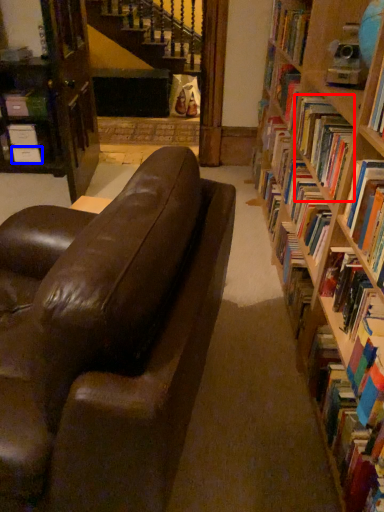
Question: Which object appears farthest to the camera in this image, book (highlighted by a red box) or paperback book (highlighted by a blue box)?

Choices:
 (A) book
 (B) paperback book

Answer: (B)